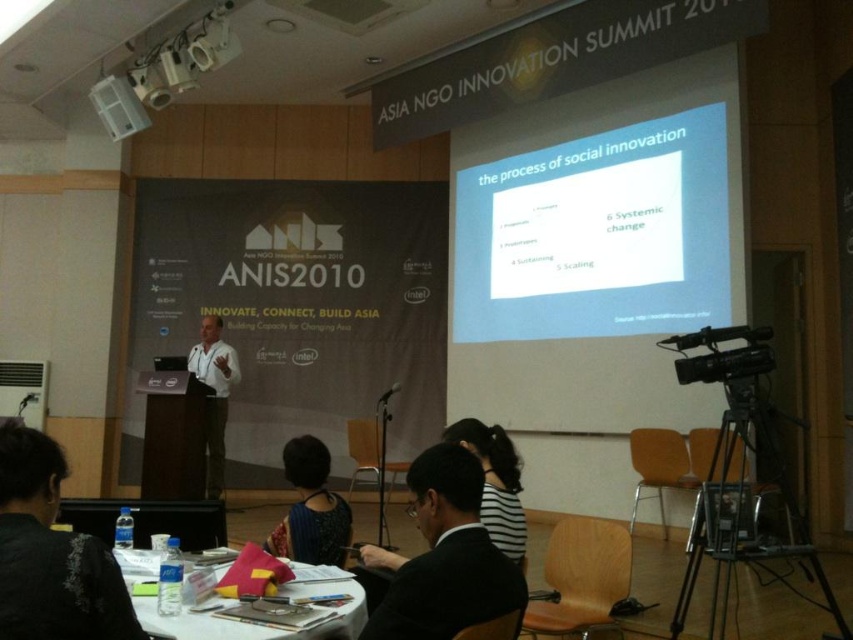
Question: In this image, where is black fabric shirt at lower left located relative to dark blue fabric dress at center?

Choices:
 (A) right
 (B) left

Answer: (B)

Question: Does white matte projector screen at upper center have a smaller size compared to dark blue fabric dress at center?

Choices:
 (A) no
 (B) yes

Answer: (A)

Question: Which point is farther from the camera taking this photo?

Choices:
 (A) (322, 518)
 (B) (500, 429)

Answer: (B)

Question: Which of the following is the closest to the observer?

Choices:
 (A) (281, 593)
 (B) (637, 312)

Answer: (A)

Question: Can you confirm if dark blue fabric dress at center is wider than white shirt at center?

Choices:
 (A) no
 (B) yes

Answer: (A)

Question: Which point is farther to the camera?

Choices:
 (A) (302, 580)
 (B) (392, 387)
 (C) (329, 540)
 (D) (109, 124)

Answer: (B)